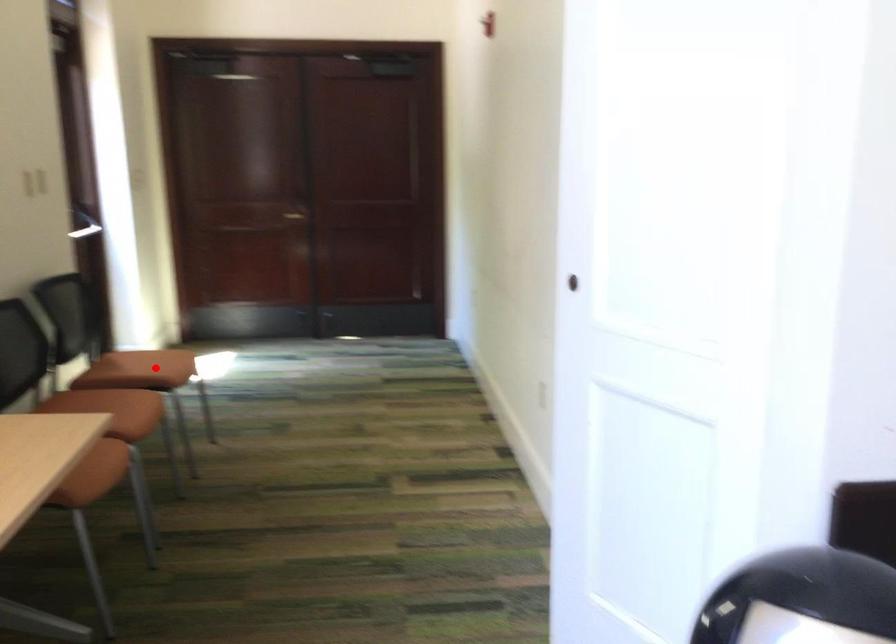
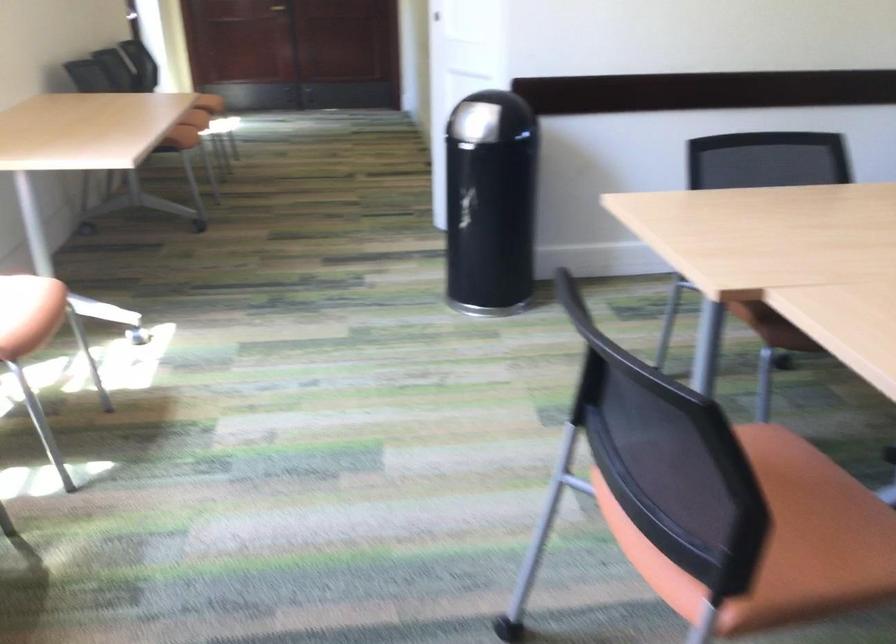
Question: I am providing you with two images of the same scene from different viewpoints. A red point is marked on the first image. Is the red point's position out of view in image 2?

Choices:
 (A) Yes
 (B) No

Answer: (A)